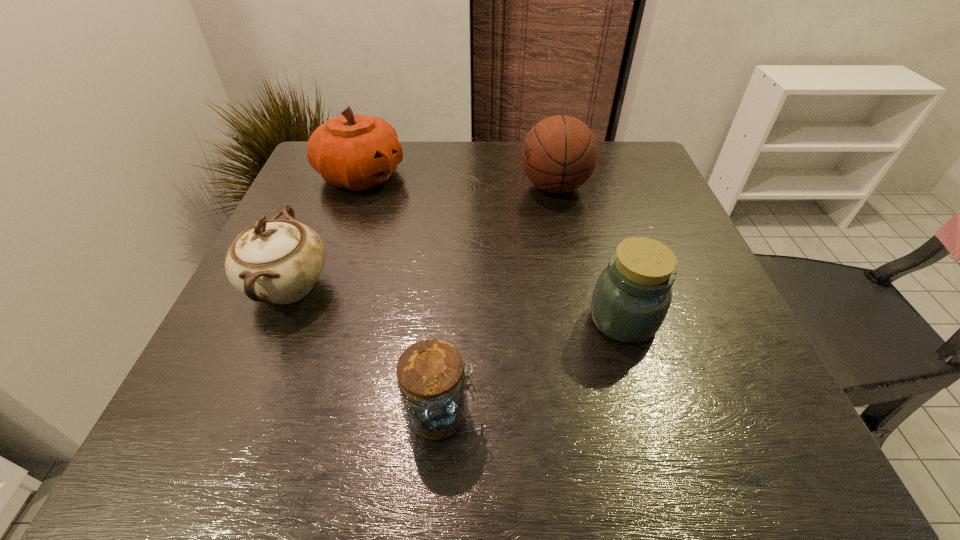
This screenshot has width=960, height=540. Find the location of `free space that satisfies the following two spatial constraints: 1. on the side with brand label of the basketball; 2. on the front side of the chinaware`. free space that satisfies the following two spatial constraints: 1. on the side with brand label of the basketball; 2. on the front side of the chinaware is located at coordinates (576, 287).